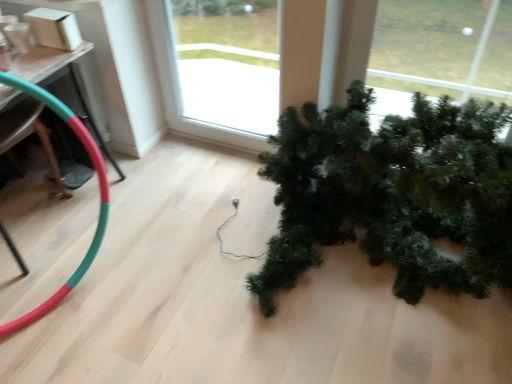
Question: From the image's perspective, is green matte christmas tree at lower right above transparent glass window at center?

Choices:
 (A) yes
 (B) no

Answer: (B)

Question: Can you confirm if green matte christmas tree at lower right is positioned to the left of transparent glass window at center?

Choices:
 (A) no
 (B) yes

Answer: (A)

Question: Are green matte christmas tree at lower right and transparent glass window at center located far from each other?

Choices:
 (A) yes
 (B) no

Answer: (A)

Question: Is green matte christmas tree at lower right bigger than transparent glass window at center?

Choices:
 (A) no
 (B) yes

Answer: (B)

Question: Considering the relative sizes of green matte christmas tree at lower right and transparent glass window at center in the image provided, is green matte christmas tree at lower right thinner than transparent glass window at center?

Choices:
 (A) yes
 (B) no

Answer: (B)

Question: Is green matte christmas tree at lower right facing away from transparent glass window at center?

Choices:
 (A) no
 (B) yes

Answer: (A)

Question: Is transparent glass window at center positioned before rubber green and red garden hose at lower left?

Choices:
 (A) no
 (B) yes

Answer: (A)

Question: Is transparent glass window at center bigger than rubber green and red garden hose at lower left?

Choices:
 (A) yes
 (B) no

Answer: (B)

Question: Can you confirm if transparent glass window at center is smaller than rubber green and red garden hose at lower left?

Choices:
 (A) yes
 (B) no

Answer: (A)

Question: From the image's perspective, is transparent glass window at center beneath rubber green and red garden hose at lower left?

Choices:
 (A) no
 (B) yes

Answer: (A)

Question: Is transparent glass window at center turned away from rubber green and red garden hose at lower left?

Choices:
 (A) no
 (B) yes

Answer: (A)

Question: Are transparent glass window at center and rubber green and red garden hose at lower left far apart?

Choices:
 (A) no
 (B) yes

Answer: (B)

Question: Is there a large distance between transparent glass window at center and green matte christmas tree at lower right?

Choices:
 (A) yes
 (B) no

Answer: (A)